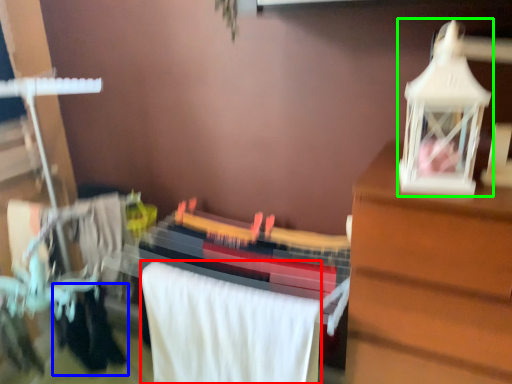
Question: Which object is positioned farthest from bath towel (highlighted by a red box)? Select from clothing (highlighted by a blue box) and toy (highlighted by a green box).

Choices:
 (A) clothing
 (B) toy

Answer: (B)